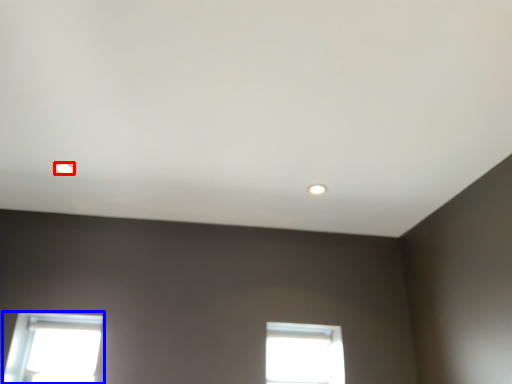
Question: Which object is further to the camera taking this photo, lighting (highlighted by a red box) or window (highlighted by a blue box)?

Choices:
 (A) lighting
 (B) window

Answer: (B)